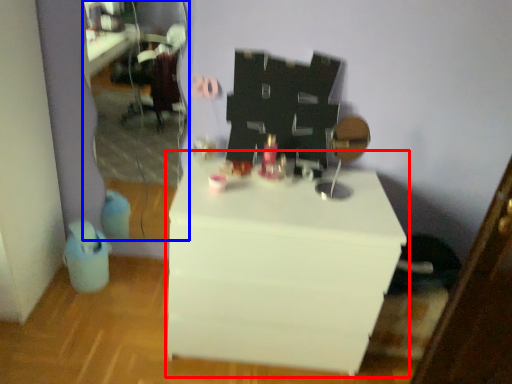
Question: Among these objects, which one is farthest to the camera, table (highlighted by a red box) or mirror (highlighted by a blue box)?

Choices:
 (A) table
 (B) mirror

Answer: (B)